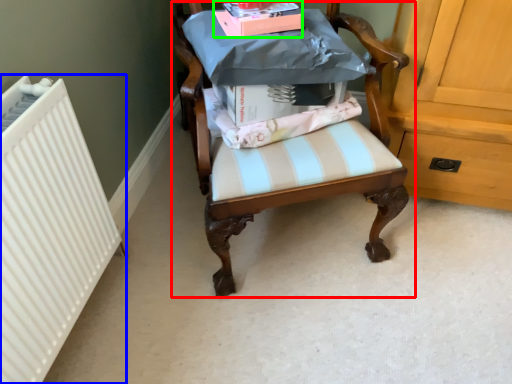
Question: Based on their relative distances, which object is farther from chair (highlighted by a red box)? Choose from radiator (highlighted by a blue box) and book (highlighted by a green box).

Choices:
 (A) radiator
 (B) book

Answer: (A)